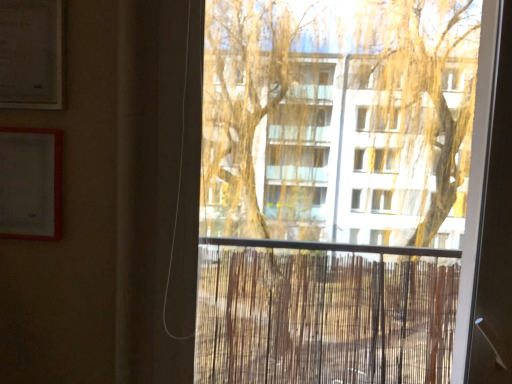
You are a GUI agent. You are given a task and a screenshot of the screen. Output one action in this format:
    pyautogui.click(x=<x>, y=<y>)
    Task: Click on the matte white paper at upper left
    
    Given the screenshot: What is the action you would take?
    pyautogui.click(x=31, y=54)

The image size is (512, 384). Describe the element at coordinates (31, 54) in the screenshot. I see `matte white paper at upper left` at that location.

You are a GUI agent. You are given a task and a screenshot of the screen. Output one action in this format:
    pyautogui.click(x=<x>, y=<y>)
    Task: Click on the matte white paper at upper left
    The image size is (512, 384).
    Given the screenshot: What is the action you would take?
    coord(31,54)